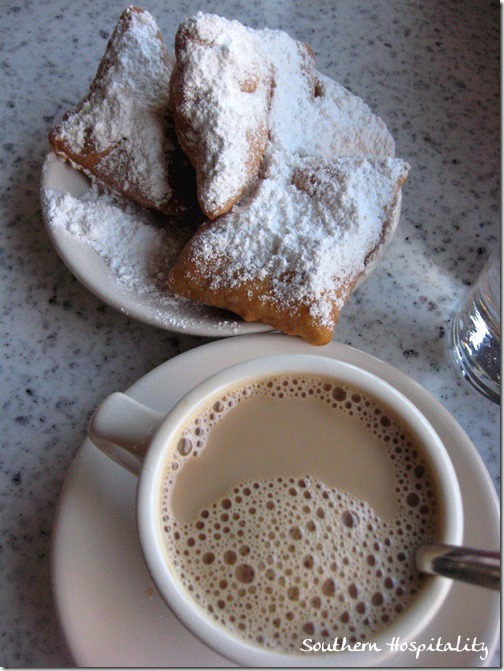
The height and width of the screenshot is (671, 504). What are the coordinates of `mug handle` in the screenshot? It's located at (123, 425).